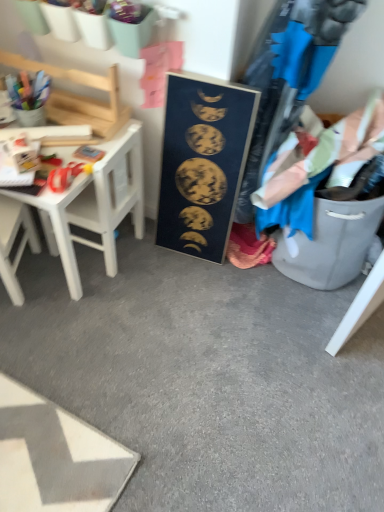
Question: Is blue cotton shirt at right at the right side of gold metallic moon phases at center?

Choices:
 (A) yes
 (B) no

Answer: (A)

Question: Is blue cotton shirt at right aimed at gold metallic moon phases at center?

Choices:
 (A) no
 (B) yes

Answer: (A)

Question: From the image's perspective, is blue cotton shirt at right above gold metallic moon phases at center?

Choices:
 (A) yes
 (B) no

Answer: (A)

Question: Considering the relative sizes of blue cotton shirt at right and gold metallic moon phases at center in the image provided, is blue cotton shirt at right smaller than gold metallic moon phases at center?

Choices:
 (A) no
 (B) yes

Answer: (A)

Question: Are blue cotton shirt at right and gold metallic moon phases at center far apart?

Choices:
 (A) yes
 (B) no

Answer: (B)

Question: From the image's perspective, is blue cotton shirt at right under gold metallic moon phases at center?

Choices:
 (A) no
 (B) yes

Answer: (A)

Question: Can you confirm if white plastic chair at left is bigger than gold metallic moon phases at center?

Choices:
 (A) no
 (B) yes

Answer: (A)

Question: Considering the relative positions of white plastic chair at left and gold metallic moon phases at center in the image provided, is white plastic chair at left behind gold metallic moon phases at center?

Choices:
 (A) yes
 (B) no

Answer: (B)

Question: Is white plastic chair at left not inside gold metallic moon phases at center?

Choices:
 (A) yes
 (B) no

Answer: (A)

Question: Considering the relative sizes of white plastic chair at left and gold metallic moon phases at center in the image provided, is white plastic chair at left shorter than gold metallic moon phases at center?

Choices:
 (A) no
 (B) yes

Answer: (B)

Question: Is white plastic chair at left directly adjacent to gold metallic moon phases at center?

Choices:
 (A) no
 (B) yes

Answer: (A)

Question: From the image's perspective, is white plastic chair at left below gold metallic moon phases at center?

Choices:
 (A) yes
 (B) no

Answer: (A)

Question: From the image's perspective, is white plastic chair at left beneath blue cotton shirt at right?

Choices:
 (A) no
 (B) yes

Answer: (B)